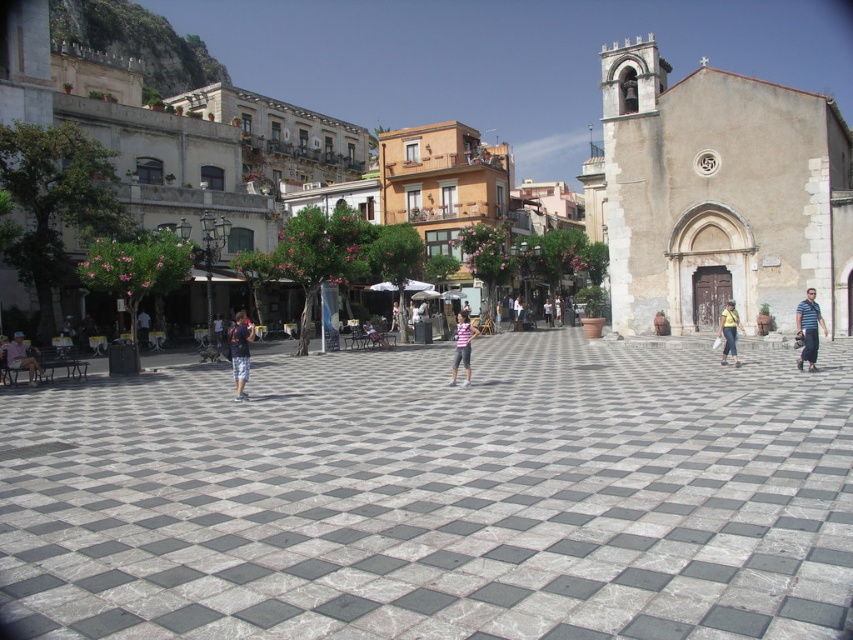
Question: Does striped fabric at center have a lesser width compared to denim shorts at lower left?

Choices:
 (A) yes
 (B) no

Answer: (A)

Question: Which point is closer to the camera taking this photo?

Choices:
 (A) (637, 12)
 (B) (801, 339)

Answer: (B)

Question: Can you confirm if blue denim shorts at center is positioned to the right of pink striped shirt at center?

Choices:
 (A) no
 (B) yes

Answer: (A)

Question: Which point is farther from the camera taking this photo?

Choices:
 (A) coord(456,355)
 (B) coord(9,349)
 (C) coord(229,340)

Answer: (C)

Question: Is matte stone plaza at center smaller than yellow fabric bag at center?

Choices:
 (A) no
 (B) yes

Answer: (A)

Question: Which point appears farthest from the camera in this image?

Choices:
 (A) (799, 362)
 (B) (73, 611)
 (C) (735, 353)
 (D) (462, 344)

Answer: (C)